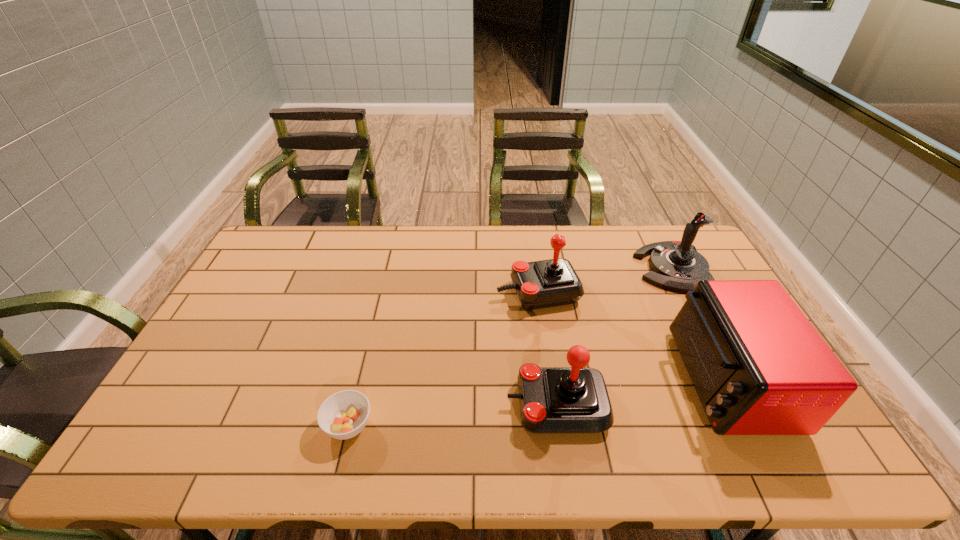
Where is `toaster oven positioned at the right edge`? toaster oven positioned at the right edge is located at coordinates (759, 367).

At what (x,y) coordinates should I click in order to perform the action: click on object present at the far right corner. Please return your answer as a coordinate pair (x, y). Looking at the image, I should click on (676, 265).

Where is `object that is at the near right corner`? The image size is (960, 540). object that is at the near right corner is located at coordinates (759, 367).

At what (x,y) coordinates should I click in order to perform the action: click on vacant space at the far edge. Please return your answer as a coordinate pair (x, y). The width and height of the screenshot is (960, 540). Looking at the image, I should click on (600, 234).

The image size is (960, 540). In the image, there is a desktop. What are the coordinates of `vacant space at the near edge` in the screenshot? It's located at (560, 457).

You are a GUI agent. You are given a task and a screenshot of the screen. Output one action in this format:
    pyautogui.click(x=<x>, y=<y>)
    Task: Click on the free spot at the left edge of the desktop
    
    Given the screenshot: What is the action you would take?
    pyautogui.click(x=220, y=356)

In the image, there is a desktop. Find the location of `free space at the far left corner`. free space at the far left corner is located at coordinates (279, 241).

The width and height of the screenshot is (960, 540). Find the location of `free space at the near left corner`. free space at the near left corner is located at coordinates (178, 446).

Image resolution: width=960 pixels, height=540 pixels. In order to click on free spot between the nearest joystick and the rightmost joystick in this screenshot , I will do `click(614, 336)`.

At what (x,y) coordinates should I click in order to perform the action: click on vacant region between the rightmost joystick and the soup bowl. Please return your answer as a coordinate pair (x, y). Looking at the image, I should click on (510, 347).